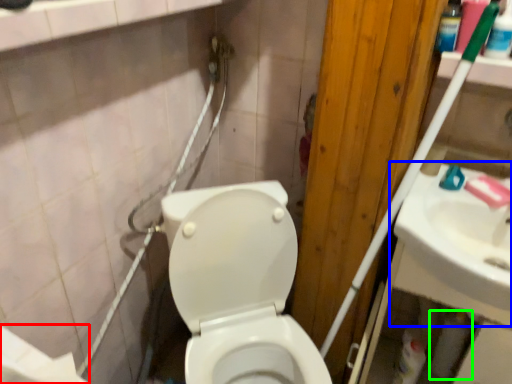
Question: Which object is positioned farthest from toilet paper (highlighted by a red box)? Select from sink (highlighted by a blue box) and toilet paper (highlighted by a green box).

Choices:
 (A) sink
 (B) toilet paper

Answer: (B)